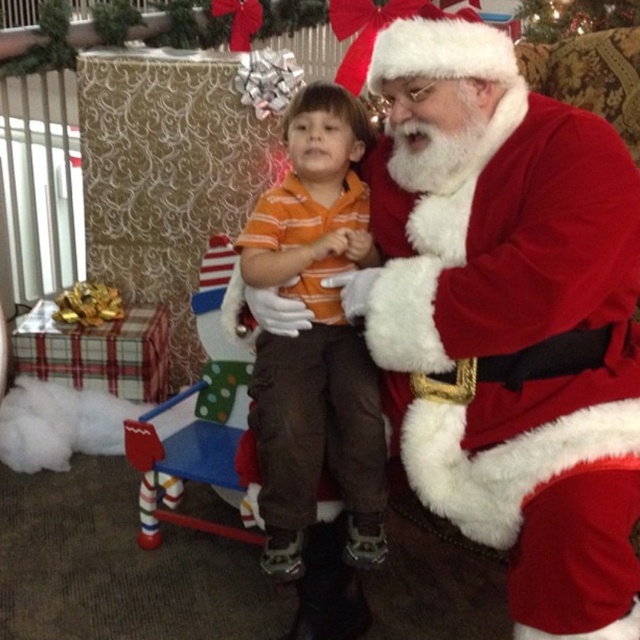
Which is more to the left, fuzzy red santa at center or green textured christmas tree at upper center?

From the viewer's perspective, fuzzy red santa at center appears more on the left side.

Does point (627, 472) come in front of point (582, 12)?

That is True.

Where is `fuzzy red santa at center`? This screenshot has height=640, width=640. fuzzy red santa at center is located at coordinates (506, 310).

Between fuzzy red santa at center and orange striped shirt at center, which one is positioned lower?

orange striped shirt at center is below.

Does fuzzy red santa at center appear on the left side of orange striped shirt at center?

Incorrect, fuzzy red santa at center is not on the left side of orange striped shirt at center.

Looking at this image, measure the distance between fuzzy red santa at center and camera.

3.63 feet

I want to click on fuzzy red santa at center, so click(506, 310).

Identify the location of orange striped shirt at center. pyautogui.click(x=316, y=337).

Between point (355, 243) and point (522, 1), which one is positioned behind?

The point (522, 1) is more distant.

Image resolution: width=640 pixels, height=640 pixels. What do you see at coordinates (316, 337) in the screenshot?
I see `orange striped shirt at center` at bounding box center [316, 337].

Identify the location of orange striped shirt at center. Image resolution: width=640 pixels, height=640 pixels. (316, 337).